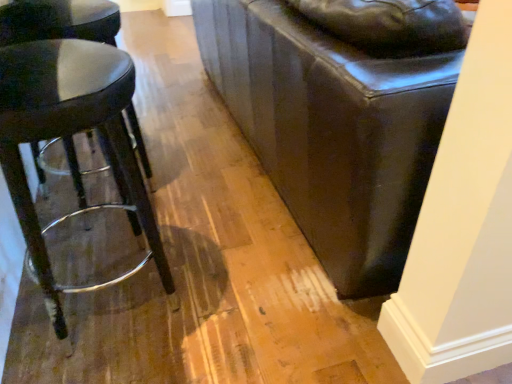
Question: Is point (17, 46) closer or farther from the camera than point (54, 18)?

Choices:
 (A) closer
 (B) farther

Answer: (A)

Question: Which is correct: matte black stool at left, marked as the first stool in a front-to-back arrangement, is inside matte black stool at left, acting as the first stool starting from the back, or outside of it?

Choices:
 (A) inside
 (B) outside

Answer: (B)

Question: In terms of width, does matte black stool at left, marked as the first stool in a front-to-back arrangement, look wider or thinner when compared to matte black stool at left, acting as the first stool starting from the back?

Choices:
 (A) thin
 (B) wide

Answer: (A)

Question: Considering the positions of point (13, 34) and point (104, 104), is point (13, 34) closer or farther from the camera than point (104, 104)?

Choices:
 (A) farther
 (B) closer

Answer: (A)

Question: Is matte black stool at left, positioned as the second stool in front-to-back order, in front of or behind matte black stool at left, the second stool viewed from the back, in the image?

Choices:
 (A) front
 (B) behind

Answer: (B)

Question: Considering the positions of matte black stool at left, positioned as the second stool in front-to-back order, and matte black stool at left, the second stool viewed from the back, in the image, is matte black stool at left, positioned as the second stool in front-to-back order, wider or thinner than matte black stool at left, the second stool viewed from the back,?

Choices:
 (A) thin
 (B) wide

Answer: (B)

Question: From the image's perspective, is matte black stool at left, acting as the first stool starting from the back, located above or below matte black stool at left, the second stool viewed from the back?

Choices:
 (A) below
 (B) above

Answer: (B)